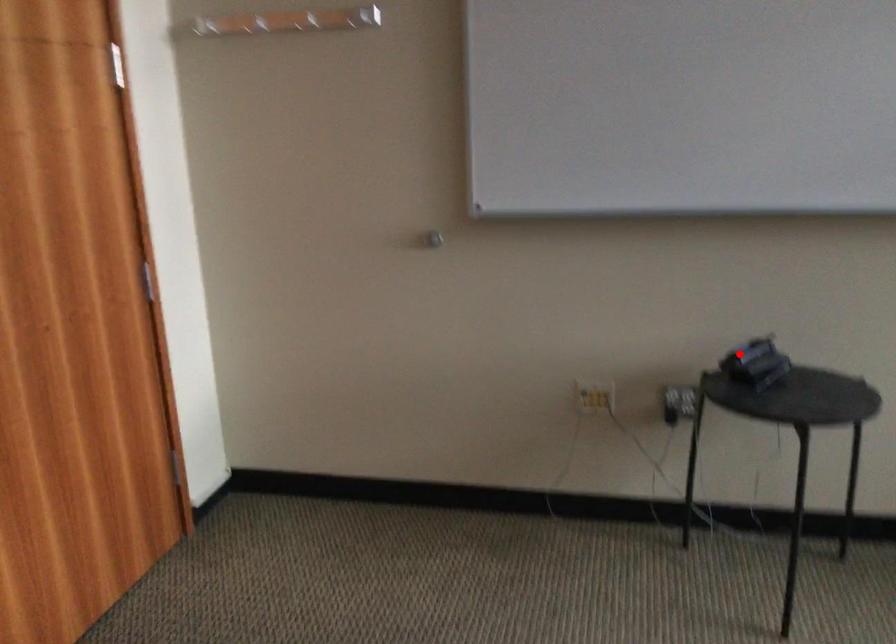
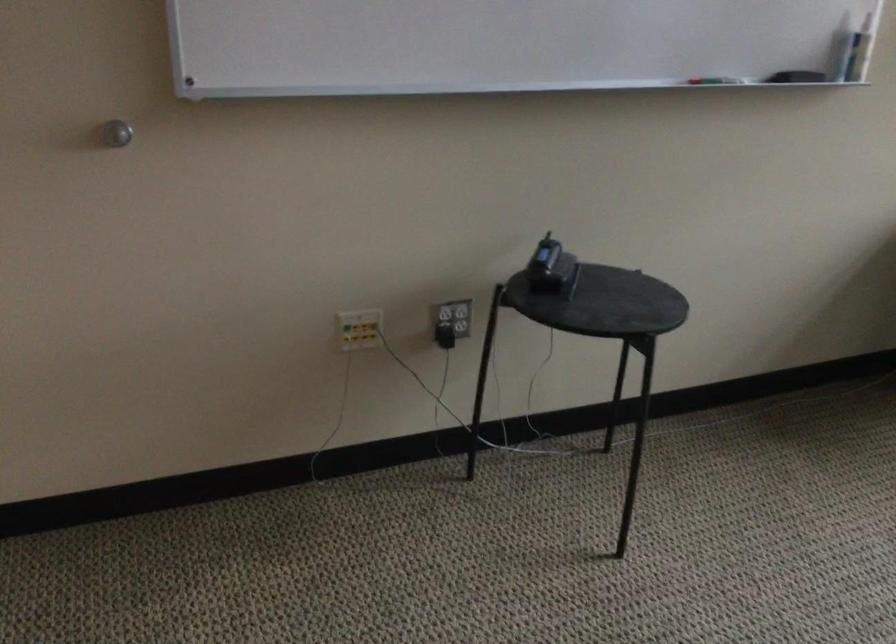
Question: I am providing you with two images of the same scene from different viewpoints. Given a red point in image1, look at the same physical point in image2. Is it:

Choices:
 (A) Closer to the viewpoint
 (B) Farther from the viewpoint

Answer: (A)